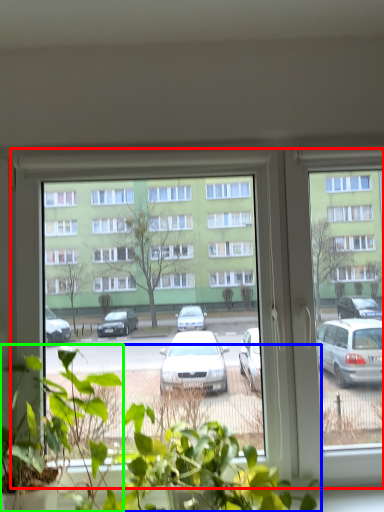
Question: Estimate the real-world distances between objects in this image. Which object is farther from window (highlighted by a red box), houseplant (highlighted by a blue box) or houseplant (highlighted by a green box)?

Choices:
 (A) houseplant
 (B) houseplant

Answer: (B)